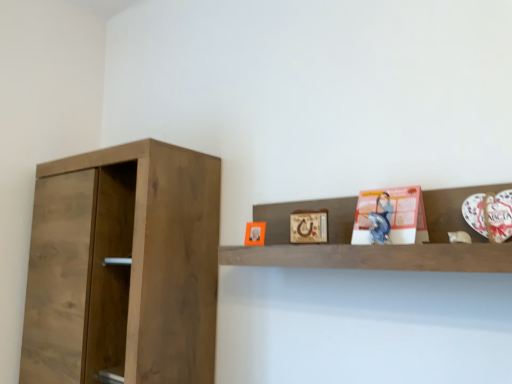
Question: Is wooden shelf at upper center inside the boundaries of walnut wood cupboard at left, or outside?

Choices:
 (A) inside
 (B) outside

Answer: (B)

Question: Based on their sizes in the image, would you say wooden shelf at upper center is bigger or smaller than walnut wood cupboard at left?

Choices:
 (A) small
 (B) big

Answer: (A)

Question: Estimate the real-world distances between objects in this image. Which object is closer to the wooden shelf at upper center?

Choices:
 (A) walnut wood cupboard at left
 (B) matte pink paper at upper right
 (C) matte orange picture frame at upper center, which is the 1th picture frame in left-to-right order
 (D) wooden picture frame at upper center, which is the second picture frame from left to right

Answer: (B)

Question: Which object is positioned farthest from the wooden picture frame at upper center, which is the second picture frame from left to right?

Choices:
 (A) wooden shelf at upper center
 (B) walnut wood cupboard at left
 (C) matte pink paper at upper right
 (D) matte orange picture frame at upper center, which is the 1th picture frame in left-to-right order

Answer: (B)